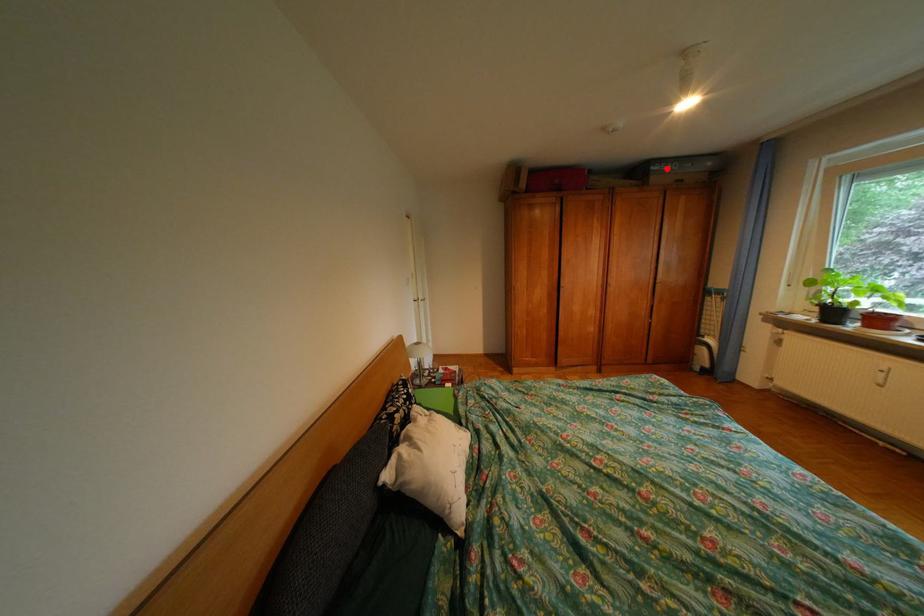
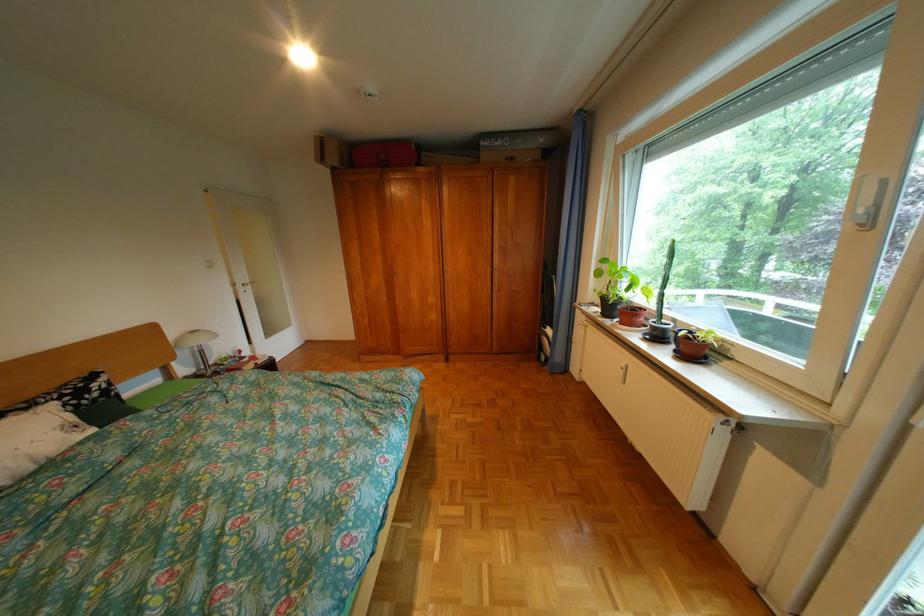
The point at the highlighted location is marked in the first image. Where is the corresponding point in the second image?

(497, 145)